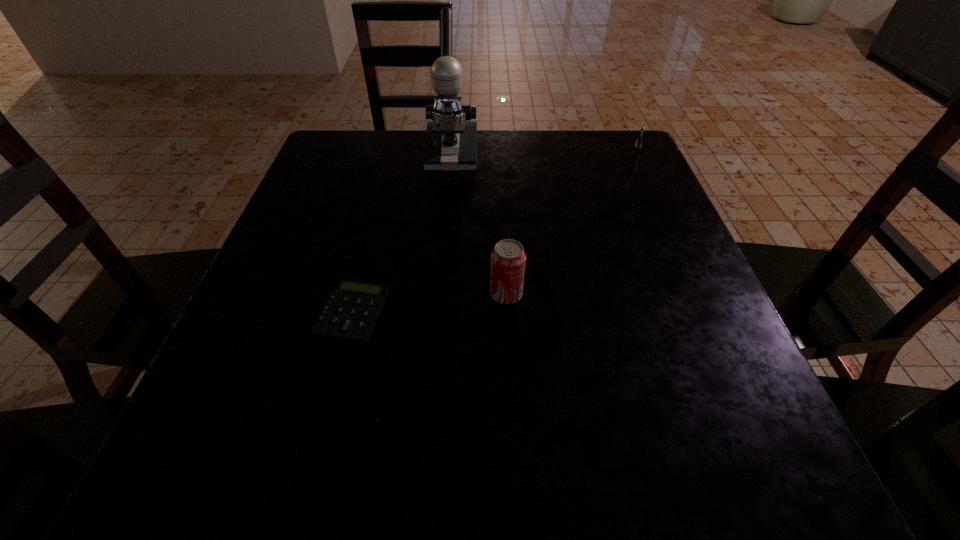
Find the location of a particular element. The width and height of the screenshot is (960, 540). free region at the near edge of the desktop is located at coordinates (465, 475).

Image resolution: width=960 pixels, height=540 pixels. I want to click on free space at the left edge of the desktop, so click(276, 356).

In the image, there is a desktop. Where is `vacant region at the right edge`? vacant region at the right edge is located at coordinates (665, 253).

This screenshot has height=540, width=960. I want to click on vacant space at the far left corner, so [349, 180].

The height and width of the screenshot is (540, 960). In order to click on vacant space at the far right corner of the desktop in this screenshot , I will do `click(601, 156)`.

This screenshot has height=540, width=960. I want to click on free point between the padlock and the leftmost object, so click(493, 235).

I want to click on free spot between the second object from right to left and the padlock, so click(570, 227).

You are a GUI agent. You are given a task and a screenshot of the screen. Output one action in this format:
    pyautogui.click(x=<x>, y=<y>)
    Task: Click on the free space between the leftmost object and the tallest object
    This screenshot has width=960, height=540.
    Given the screenshot: What is the action you would take?
    [x=402, y=233]

Find the location of a particular element. vacant space that is in between the third object from left to right and the second shortest object is located at coordinates (570, 227).

Image resolution: width=960 pixels, height=540 pixels. Find the location of `vacant point located between the shortest object and the padlock`. vacant point located between the shortest object and the padlock is located at coordinates pos(493,235).